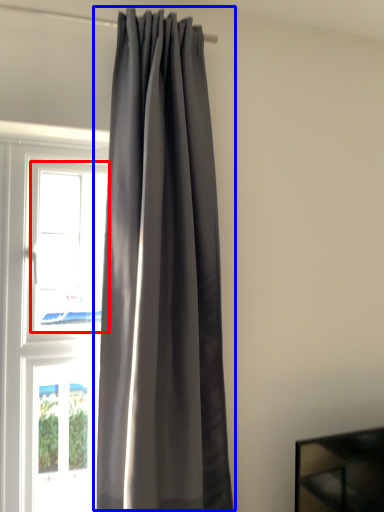
Question: Among these objects, which one is nearest to the camera, window (highlighted by a red box) or curtain (highlighted by a blue box)?

Choices:
 (A) window
 (B) curtain

Answer: (B)